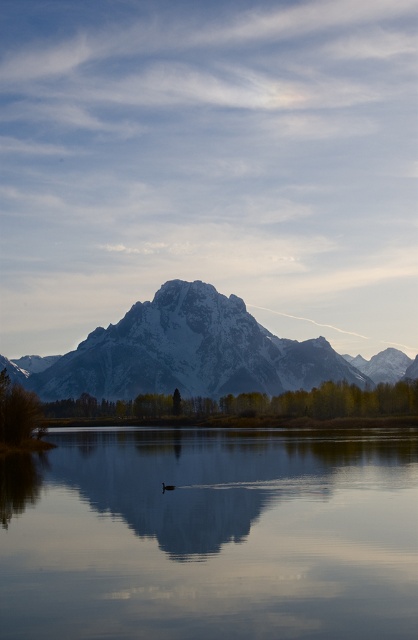
Is smooth glass water at center bigger than white snow-covered mountain range at center?

No, smooth glass water at center is not bigger than white snow-covered mountain range at center.

Who is positioned more to the left, smooth glass water at center or white snow-covered mountain range at center?

Positioned to the left is smooth glass water at center.

What do you see at coordinates (211, 536) in the screenshot? Image resolution: width=418 pixels, height=640 pixels. I see `smooth glass water at center` at bounding box center [211, 536].

Identify the location of smooth glass water at center. Image resolution: width=418 pixels, height=640 pixels. (211, 536).

Who is positioned more to the right, white snow-covered mountain range at center or brown matte duck at center?

Positioned to the right is white snow-covered mountain range at center.

Is white snow-covered mountain range at center smaller than brown matte duck at center?

No.

Is point (272, 388) farther from camera compared to point (173, 486)?

Yes, it is.

Image resolution: width=418 pixels, height=640 pixels. In order to click on white snow-covered mountain range at center in this screenshot , I will do 191,353.

Can you confirm if smooth glass water at center is taller than brown matte duck at center?

Indeed, smooth glass water at center has a greater height compared to brown matte duck at center.

Is smooth glass water at center shorter than brown matte duck at center?

No.

Is point (326, 536) behind point (165, 486)?

No, it is in front of (165, 486).

Find the location of a particular element. smooth glass water at center is located at coordinates (211, 536).